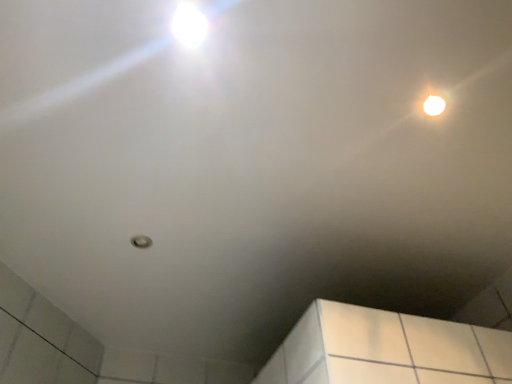
Question: From a real-world perspective, relative to white glossy droplight at upper right, the second droplight viewed from the left, is white glossy droplight at upper left, placed as the second droplight when sorted from back to front, vertically above or below?

Choices:
 (A) above
 (B) below

Answer: (B)

Question: Based on their positions, is white glossy droplight at upper left, the 1th droplight viewed from the front, located to the left or right of white glossy droplight at upper right, arranged as the 2th droplight when viewed from the top?

Choices:
 (A) left
 (B) right

Answer: (A)

Question: Considering the positions of white glossy droplight at upper left, positioned as the 2th droplight in right-to-left order, and white glossy droplight at upper right, acting as the 2th droplight starting from the front, in the image, is white glossy droplight at upper left, positioned as the 2th droplight in right-to-left order, taller or shorter than white glossy droplight at upper right, acting as the 2th droplight starting from the front,?

Choices:
 (A) tall
 (B) short

Answer: (B)

Question: Is white glossy droplight at upper right, marked as the first droplight in a bottom-to-top arrangement, wider or thinner than white glossy droplight at upper left, placed as the second droplight when sorted from back to front?

Choices:
 (A) wide
 (B) thin

Answer: (B)

Question: From the image's perspective, is white glossy droplight at upper right, acting as the 2th droplight starting from the front, located above or below white glossy droplight at upper left, arranged as the first droplight when viewed from the left?

Choices:
 (A) above
 (B) below

Answer: (B)

Question: Is white glossy droplight at upper right, arranged as the 2th droplight when viewed from the top, taller or shorter than white glossy droplight at upper left, positioned as the 2th droplight in right-to-left order?

Choices:
 (A) tall
 (B) short

Answer: (A)

Question: Is white glossy droplight at upper right, marked as the first droplight in a bottom-to-top arrangement, to the left or to the right of white glossy droplight at upper left, placed as the second droplight when sorted from back to front, in the image?

Choices:
 (A) right
 (B) left

Answer: (A)